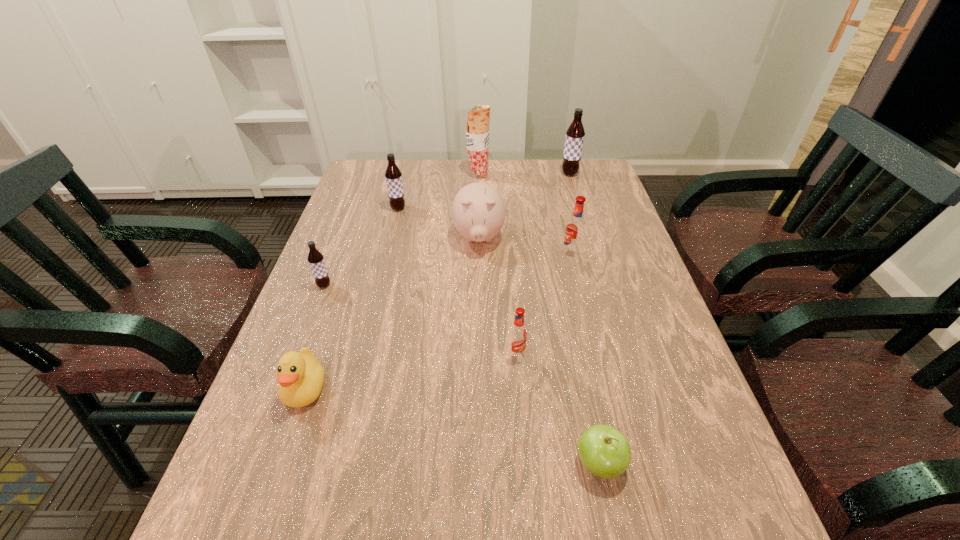
Identify the location of free space located at the snout of the piggy bank. Image resolution: width=960 pixels, height=540 pixels. (478, 350).

Where is `free spot located 0.060m on the front of the leftmost root beer`? This screenshot has height=540, width=960. free spot located 0.060m on the front of the leftmost root beer is located at coordinates (316, 308).

Locate an element on the screen. Image resolution: width=960 pixels, height=540 pixels. free space located 0.170m on the right of the nearest root beer is located at coordinates point(604,354).

At what (x,y) coordinates should I click in order to perform the action: click on free region located 0.130m at the beak of the eighth farthest object. Please return your answer as a coordinate pair (x, y). Looking at the image, I should click on (274, 482).

The height and width of the screenshot is (540, 960). I want to click on vacant space located on the right of the green apple, so click(716, 463).

At what (x,y) coordinates should I click in order to perform the action: click on burrito present at the far edge. Please return your answer as a coordinate pair (x, y). This screenshot has height=540, width=960. Looking at the image, I should click on (477, 134).

At what (x,y) coordinates should I click in order to perform the action: click on root beer at the far edge. Please return your answer as a coordinate pair (x, y). Looking at the image, I should click on (575, 133).

Locate an element on the screen. The width and height of the screenshot is (960, 540). duck present at the left edge is located at coordinates (300, 376).

At what (x,y) coordinates should I click in order to perform the action: click on object that is at the far right corner. Please return your answer as a coordinate pair (x, y). This screenshot has width=960, height=540. Looking at the image, I should click on (575, 133).

At what (x,y) coordinates should I click in order to perform the action: click on free space at the far edge of the desktop. Please return your answer as a coordinate pair (x, y). Image resolution: width=960 pixels, height=540 pixels. Looking at the image, I should click on (541, 185).